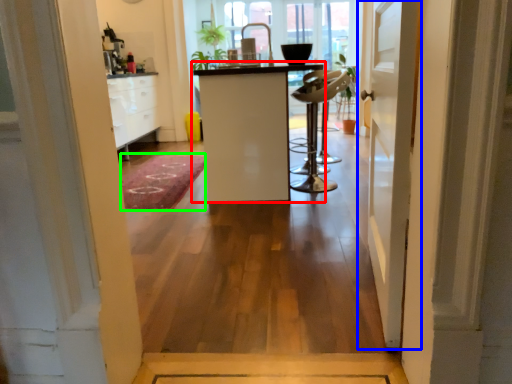
Question: Considering the real-world distances, which object is farthest from furniture (highlighted by a red box)? door (highlighted by a blue box) or doormat (highlighted by a green box)?

Choices:
 (A) door
 (B) doormat

Answer: (A)